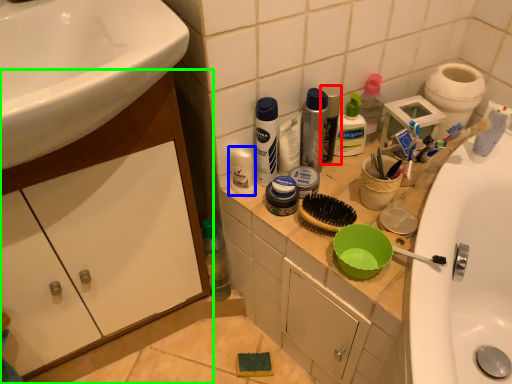
Question: Estimate the real-world distances between objects in this image. Which object is closer to mouthwash (highlighted by a red box), toiletry (highlighted by a blue box) or bathroom cabinet (highlighted by a green box)?

Choices:
 (A) toiletry
 (B) bathroom cabinet

Answer: (A)